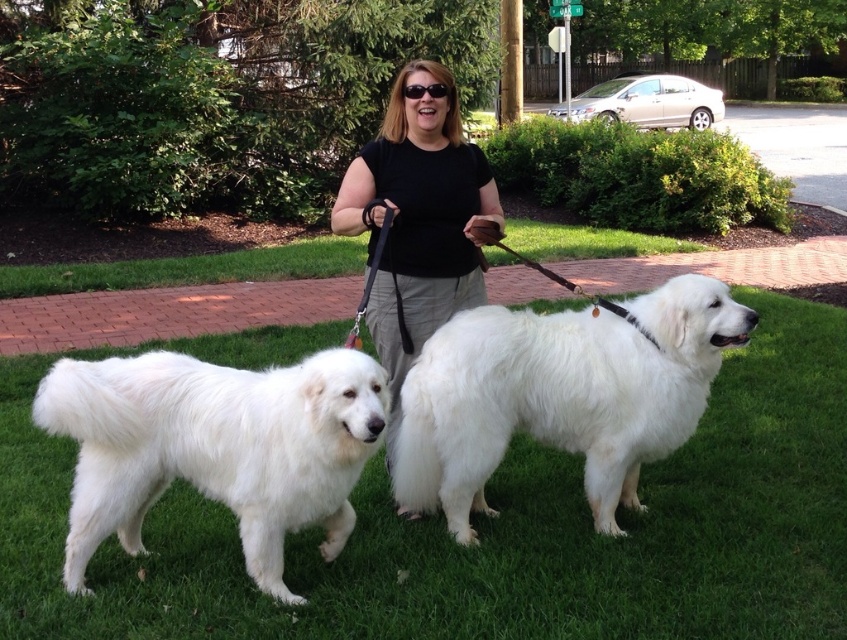
You are standing at the point labeled point (253, 497) and want to walk towards the point labeled point (446, 188). Since you can only move forward, will you get closer to the camera or farther away from it as you walk?

As you walk from point (253, 497) towards point (446, 188), you will be moving away from the camera because point (253, 497) is closer to the camera than point (446, 188).

You are a photographer trying to capture a photo of both dogs. Since you want them both in the frame, which direction should you position yourself relative to the white fluffy dog at lower left and the white fluffy dog at center?

You should position yourself to the left of the white fluffy dog at lower left and to the right of the white fluffy dog at center so that both dogs are in the frame.

From the picture: You are a photographer positioned to the left of the scene. You want to take a photo that includes both the green grass at center and the black fabric shirt at center. Based on their positions, which object should you adjust your camera to focus on first to ensure both are in the frame?

The black fabric shirt at center is to the left of the green grass at center. To include both in the frame, focus on the black fabric shirt at center first since it is closer to your left position, then adjust to include the green grass at center to the right.